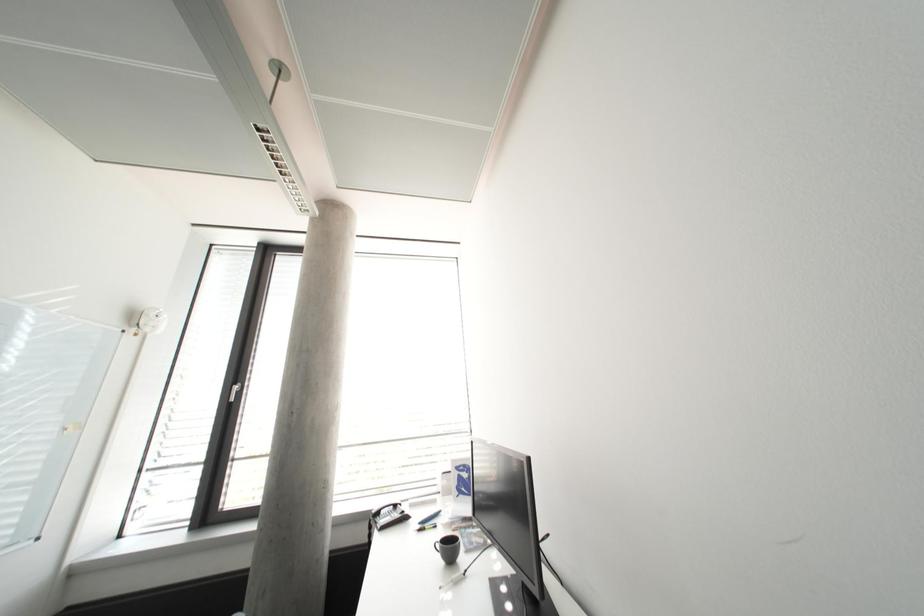
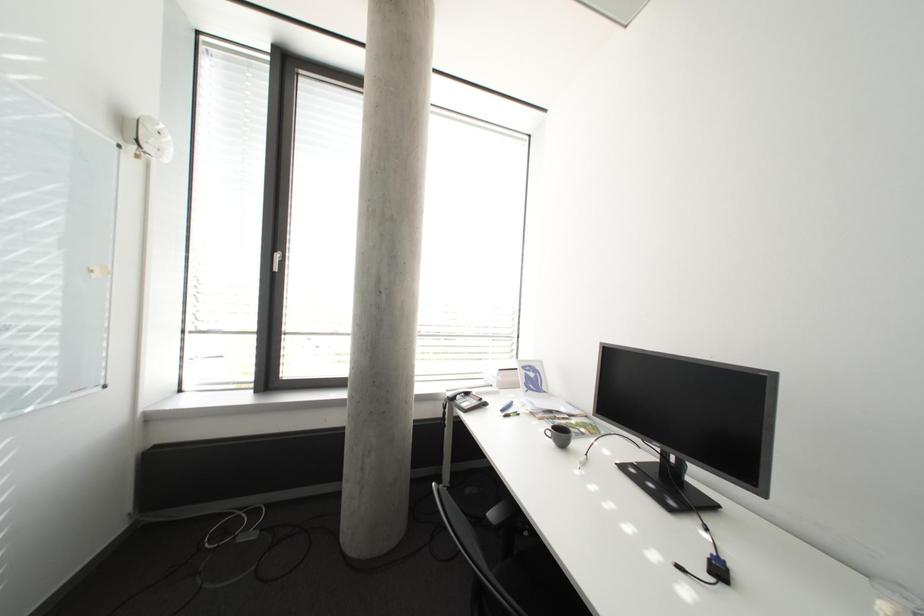
Question: Based on the continuous images, in which direction is the camera rotating? Reply with the corresponding letter.

Choices:
 (A) Left
 (B) Right
 (C) Up
 (D) Down

Answer: (D)